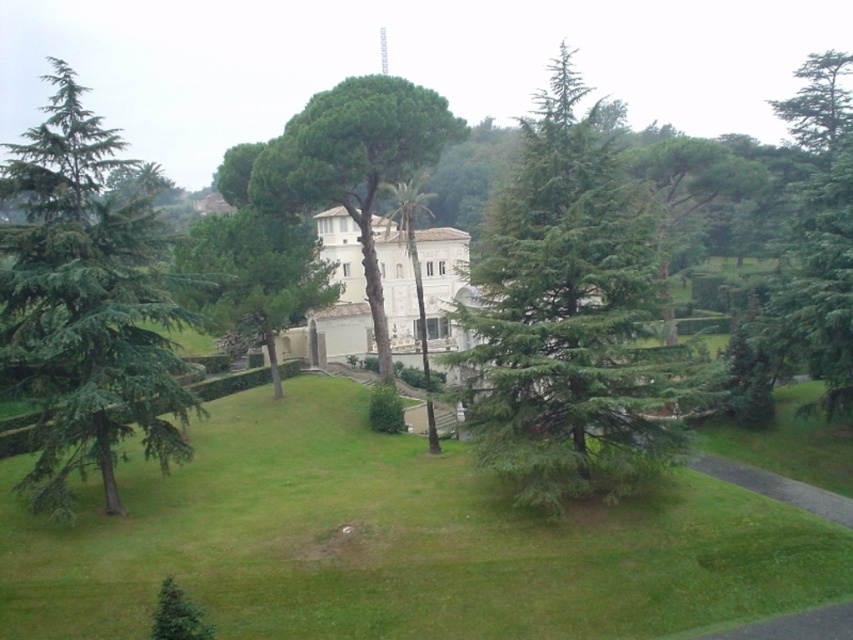
In the scene shown: Which is below, green needle-like tree at center or green needle-like tree at left?

Positioned lower is green needle-like tree at center.

Is point (660, 420) more distant than point (39, 260)?

Yes, point (660, 420) is behind point (39, 260).

Is point (521, 349) behind point (157, 372)?

Yes, it is.

At what (x,y) coordinates should I click in order to perform the action: click on green needle-like tree at center. Please return your answer as a coordinate pair (x, y). Looking at the image, I should click on pyautogui.click(x=567, y=316).

What do you see at coordinates (395, 541) in the screenshot?
I see `green grassy at center` at bounding box center [395, 541].

Is point (189, 582) positioned after point (560, 376)?

No, (189, 582) is closer to viewer.

Is point (96, 508) positioned behind point (569, 432)?

No.

At what (x,y) coordinates should I click in order to perform the action: click on green grassy at center. Please return your answer as a coordinate pair (x, y). Looking at the image, I should click on (395, 541).

Is green needle-like tree at left to the left of green leafy tree at center from the viewer's perspective?

Correct, you'll find green needle-like tree at left to the left of green leafy tree at center.

Is green needle-like tree at left closer to camera compared to green leafy tree at center?

Yes, green needle-like tree at left is in front of green leafy tree at center.

Who is more forward, (82, 269) or (341, 177)?

Positioned in front is point (82, 269).

Locate an element on the screen. green needle-like tree at left is located at coordinates (86, 301).